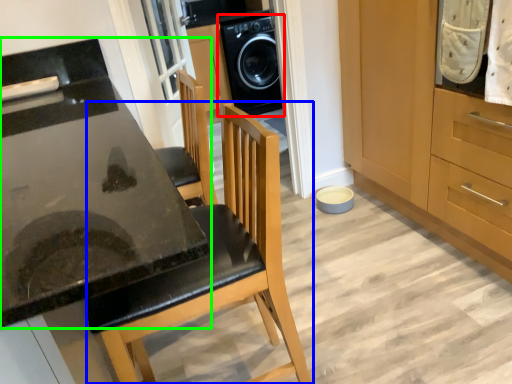
Question: Which object is the farthest from home appliance (highlighted by a red box)? Choose among these: chair (highlighted by a blue box) or countertop (highlighted by a green box).

Choices:
 (A) chair
 (B) countertop

Answer: (A)